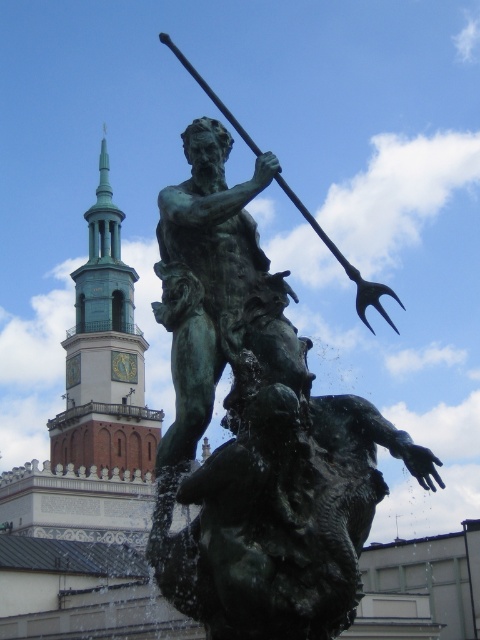
Question: Which object appears closest to the camera in this image?

Choices:
 (A) green patina bronze statue at center
 (B) green patina tower at upper left

Answer: (A)

Question: Does green patina bronze statue at center appear on the left side of green patina tower at upper left?

Choices:
 (A) no
 (B) yes

Answer: (A)

Question: Does green patina bronze statue at center have a greater width compared to green patina tower at upper left?

Choices:
 (A) no
 (B) yes

Answer: (A)

Question: Among these points, which one is nearest to the camera?

Choices:
 (A) (118, 413)
 (B) (277, 404)

Answer: (B)

Question: Does green patina bronze statue at center appear under green patina tower at upper left?

Choices:
 (A) yes
 (B) no

Answer: (B)